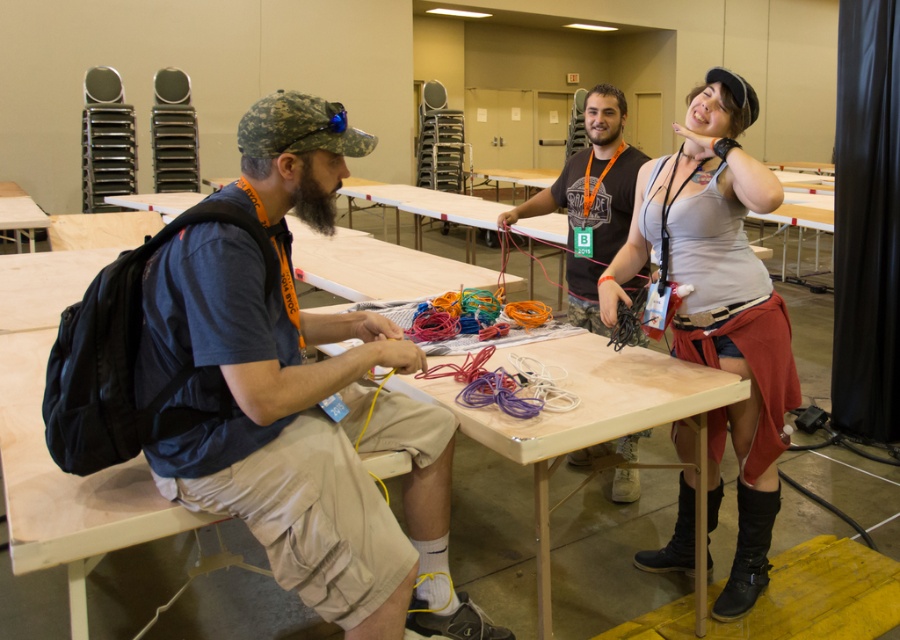
Between gray fabric tank top at upper right and camouflage tank top at center, which one appears on the right side from the viewer's perspective?

gray fabric tank top at upper right

This screenshot has width=900, height=640. Find the location of `gray fabric tank top at upper right`. gray fabric tank top at upper right is located at coordinates (720, 305).

You are a GUI agent. You are given a task and a screenshot of the screen. Output one action in this format:
    pyautogui.click(x=<x>, y=<y>)
    Task: Click on the gray fabric tank top at upper right
    The height and width of the screenshot is (640, 900).
    Given the screenshot: What is the action you would take?
    pyautogui.click(x=720, y=305)

Is point (291, 129) more distant than point (614, 180)?

No, (291, 129) is in front of (614, 180).

Describe the element at coordinates (299, 397) in the screenshot. I see `matte blue shirt at left` at that location.

Who is more distant from viewer, (243, 344) or (579, 212)?

Positioned behind is point (579, 212).

You are a GUI agent. You are given a task and a screenshot of the screen. Output one action in this format:
    pyautogui.click(x=<x>, y=<y>)
    Task: Click on the matte blue shirt at left
    The height and width of the screenshot is (640, 900).
    Given the screenshot: What is the action you would take?
    pyautogui.click(x=299, y=397)

What do you see at coordinates (720, 305) in the screenshot? This screenshot has height=640, width=900. I see `gray fabric tank top at upper right` at bounding box center [720, 305].

Who is more forward, (731, 93) or (432, 362)?

Point (731, 93)

Between point (756, 461) and point (622, 362), which one is positioned in front?

Point (622, 362) is more forward.

Locate an element on the screen. Image resolution: width=900 pixels, height=640 pixels. gray fabric tank top at upper right is located at coordinates (720, 305).